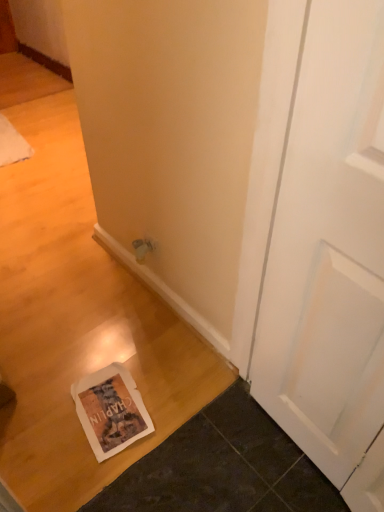
Measure the distance between point (x=333, y=336) and camera.

Point (x=333, y=336) is 37.72 inches away from camera.

I want to click on white matte door at center, so click(329, 247).

What do you see at coordinates (329, 247) in the screenshot? I see `white matte door at center` at bounding box center [329, 247].

Image resolution: width=384 pixels, height=512 pixels. I want to click on white matte door at center, so click(329, 247).